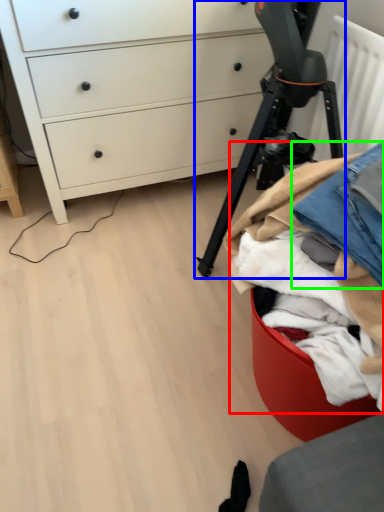
Question: Based on their relative distances, which object is farther from clothing (highlighted by a red box)? Choose from tripod (highlighted by a blue box) and jeans (highlighted by a green box).

Choices:
 (A) tripod
 (B) jeans

Answer: (A)